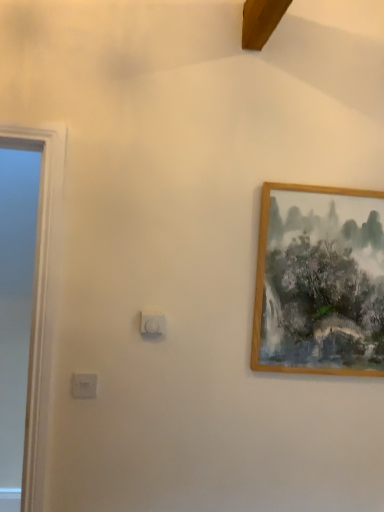
Question: Is the position of wooden picture frame at upper right more distant than that of white plastic light switch at center, the 1th light switch when ordered from right to left?

Choices:
 (A) yes
 (B) no

Answer: (A)

Question: Considering the relative positions of wooden picture frame at upper right and white plastic light switch at center, which is counted as the 2th light switch, starting from the left, in the image provided, is wooden picture frame at upper right to the right of white plastic light switch at center, which is counted as the 2th light switch, starting from the left, from the viewer's perspective?

Choices:
 (A) yes
 (B) no

Answer: (A)

Question: Is wooden picture frame at upper right located outside white plastic light switch at center, which is counted as the 2th light switch, starting from the left?

Choices:
 (A) no
 (B) yes

Answer: (B)

Question: From the image's perspective, is wooden picture frame at upper right over white plastic light switch at center, which is counted as the 2th light switch, starting from the left?

Choices:
 (A) yes
 (B) no

Answer: (A)

Question: Could white plastic light switch at center, the 2th light switch positioned from the bottom, be considered to be inside wooden picture frame at upper right?

Choices:
 (A) yes
 (B) no

Answer: (B)

Question: Considering their positions, is white plastic light switch at center, the 1th light switch when ordered from right to left, located in front of or behind white plastic light switch at lower left, the first light switch viewed from the left?

Choices:
 (A) front
 (B) behind

Answer: (B)

Question: From the image's perspective, relative to white plastic light switch at lower left, which ranks as the 2th light switch in right-to-left order, is white plastic light switch at center, the 2th light switch positioned from the bottom, above or below?

Choices:
 (A) above
 (B) below

Answer: (A)

Question: From a real-world perspective, is white plastic light switch at center, the 1th light switch in the top-to-bottom sequence, positioned above or below white plastic light switch at lower left, the 2th light switch positioned from the top?

Choices:
 (A) below
 (B) above

Answer: (B)

Question: In terms of size, does white plastic light switch at center, the 1th light switch when ordered from right to left, appear bigger or smaller than white plastic light switch at lower left, the 2th light switch positioned from the top?

Choices:
 (A) big
 (B) small

Answer: (A)

Question: From a real-world perspective, is wooden picture frame at upper right positioned above or below white plastic light switch at lower left, which ranks as the 2th light switch in right-to-left order?

Choices:
 (A) above
 (B) below

Answer: (A)

Question: From the image's perspective, is wooden picture frame at upper right above or below white plastic light switch at lower left, positioned as the 1th light switch in bottom-to-top order?

Choices:
 (A) below
 (B) above

Answer: (B)

Question: Is point (332, 365) positioned closer to the camera than point (82, 380)?

Choices:
 (A) farther
 (B) closer

Answer: (A)

Question: In terms of height, does wooden picture frame at upper right look taller or shorter compared to white plastic light switch at lower left, the first light switch viewed from the left?

Choices:
 (A) short
 (B) tall

Answer: (B)

Question: Is point tap(269, 338) positioned closer to the camera than point tap(160, 328)?

Choices:
 (A) closer
 (B) farther

Answer: (B)

Question: Would you say wooden picture frame at upper right is to the left or to the right of white plastic light switch at center, the 1th light switch in the top-to-bottom sequence, in the picture?

Choices:
 (A) right
 (B) left

Answer: (A)